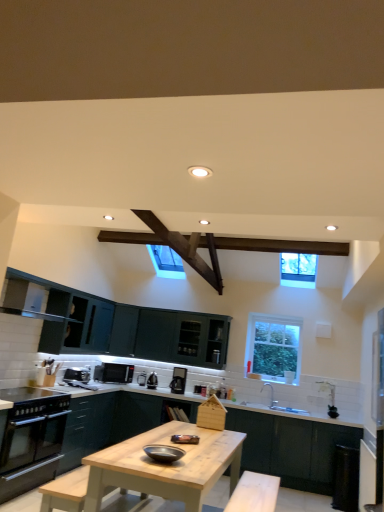
Question: Looking at their shapes, would you say matte dark green cabinet at center, arranged as the second cabinetry when viewed from the right, is wider or thinner than clear glass window at upper right, the 2th window viewed from the front?

Choices:
 (A) wide
 (B) thin

Answer: (A)

Question: From their relative heights in the image, would you say matte dark green cabinet at center, arranged as the second cabinetry when viewed from the right, is taller or shorter than clear glass window at upper right, which is the 1th window in back-to-front order?

Choices:
 (A) tall
 (B) short

Answer: (B)

Question: Estimate the real-world distances between objects in this image. Which object is closer to the clear glass window at upper center, placed as the 1th window when sorted from top to bottom?

Choices:
 (A) matte dark green cabinet at center, arranged as the second cabinetry when viewed from the right
 (B) clear glass window at upper right, the first window when ordered from bottom to top
 (C) light wood table at center
 (D) dark wood beam at upper center
 (E) dark green matte cabinet at lower center, positioned as the second cabinetry in left-to-right order

Answer: (B)

Question: Which is nearer to the matte black microwave at center, which is the 4th appliance in right-to-left order?

Choices:
 (A) matte dark green cabinet at center, acting as the first cabinetry starting from the left
 (B) dark green matte cabinet at lower center, positioned as the second cabinetry in left-to-right order
 (C) light wood table at center
 (D) white ceramic sink at lower center
 (E) dark wood beam at upper center

Answer: (A)